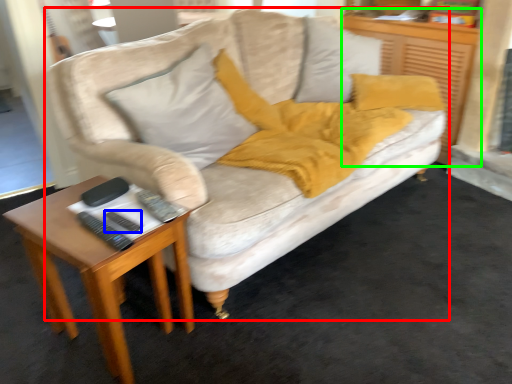
Question: Considering the real-world distances, which object is closest to studio couch (highlighted by a red box)? remote (highlighted by a blue box) or dresser (highlighted by a green box).

Choices:
 (A) remote
 (B) dresser

Answer: (B)